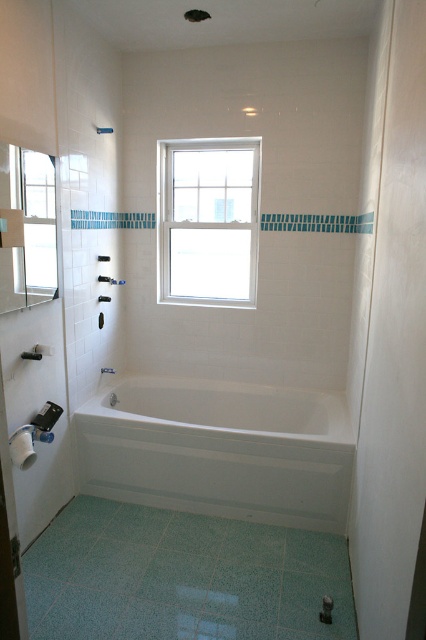
Which is more to the right, white glossy bathtub at center or white glass window at upper center?

white glossy bathtub at center

Which is below, white glossy bathtub at center or white glass window at upper center?

white glossy bathtub at center is lower down.

The width and height of the screenshot is (426, 640). Find the location of `white glossy bathtub at center`. white glossy bathtub at center is located at coordinates (218, 451).

At what (x,y) coordinates should I click in order to perform the action: click on white glossy bathtub at center. Please return your answer as a coordinate pair (x, y). The image size is (426, 640). Looking at the image, I should click on (218, 451).